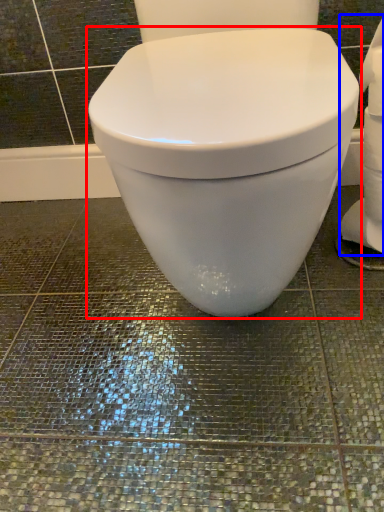
Question: Which of the following is the closest to the observer, toilet (highlighted by a red box) or toilet paper (highlighted by a blue box)?

Choices:
 (A) toilet
 (B) toilet paper

Answer: (A)